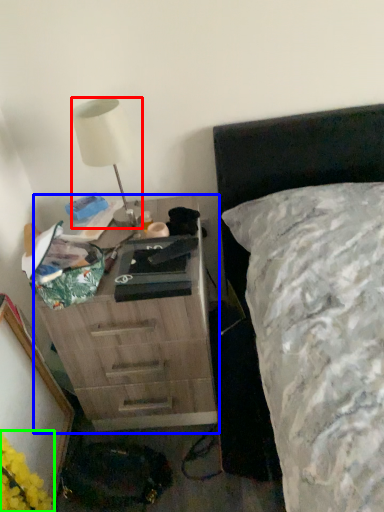
Question: Which is farther away from lamp (highlighted by a red box)? chest of drawers (highlighted by a blue box) or flower (highlighted by a green box)?

Choices:
 (A) chest of drawers
 (B) flower

Answer: (B)